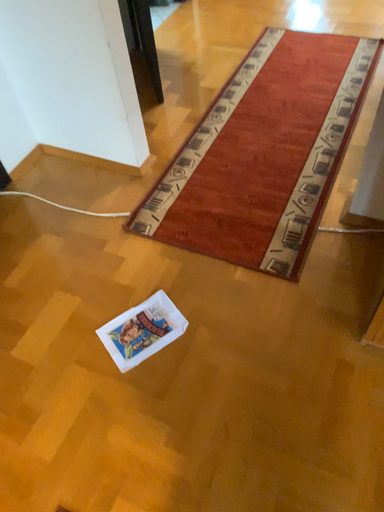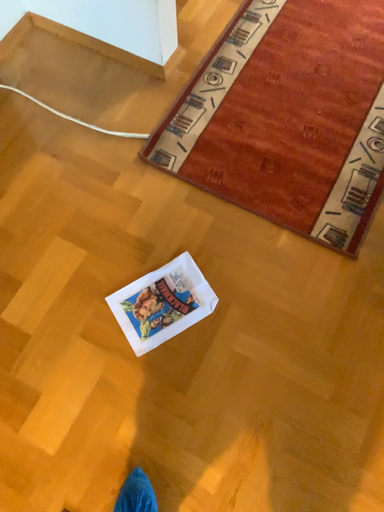
Question: How did the camera likely rotate when shooting the video?

Choices:
 (A) rotated downward
 (B) rotated upward

Answer: (A)